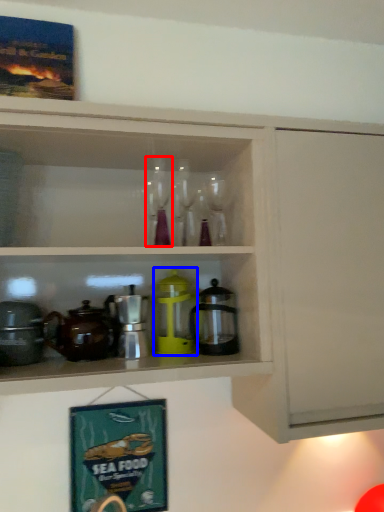
Question: Which object appears farthest to the camera in this image, wine glass (highlighted by a red box) or appliance (highlighted by a blue box)?

Choices:
 (A) wine glass
 (B) appliance

Answer: (B)